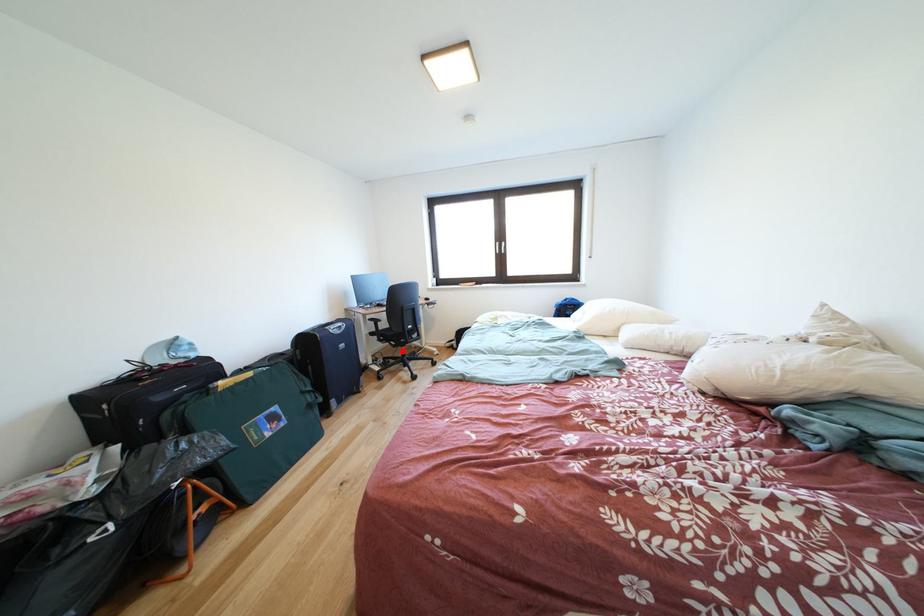
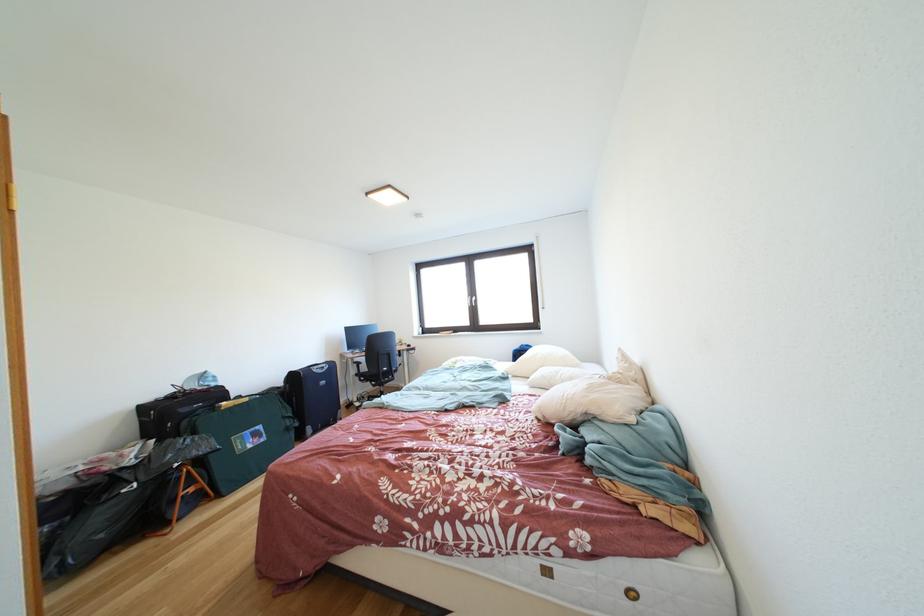
In the second image, find the point that corresponds to the highlighted location in the first image.

(383, 391)